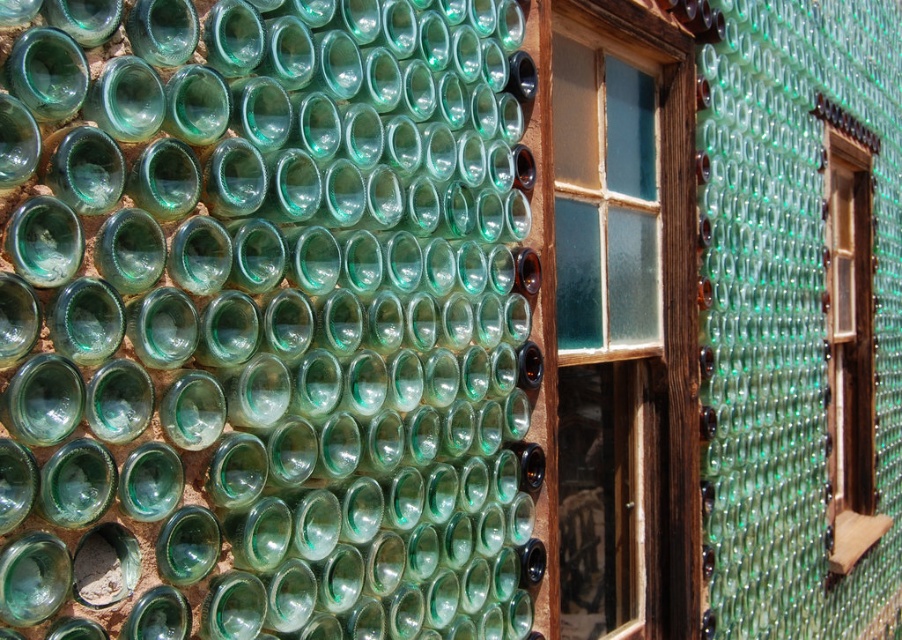
Which is below, green translucent bottle at center or wooden frame window at right?

wooden frame window at right is lower down.

Who is more forward, (14, 301) or (843, 196)?

Point (14, 301) is in front.

Which is in front, point (284, 365) or point (843, 132)?

Point (284, 365) is in front.

This screenshot has width=902, height=640. Identify the location of green translucent bottle at center. (264, 321).

Between green translucent bottle at center and wooden-framed window at center, which one is positioned higher?

green translucent bottle at center is above.

Locate an element on the screen. The image size is (902, 640). green translucent bottle at center is located at coordinates (264, 321).

Does wooden-framed window at center appear on the left side of wooden frame window at right?

Correct, you'll find wooden-framed window at center to the left of wooden frame window at right.

Does wooden-framed window at center lie in front of wooden frame window at right?

Yes.

Who is more forward, [642,291] or [845,552]?

Positioned in front is point [642,291].

Locate an element on the screen. The width and height of the screenshot is (902, 640). wooden-framed window at center is located at coordinates (621, 304).